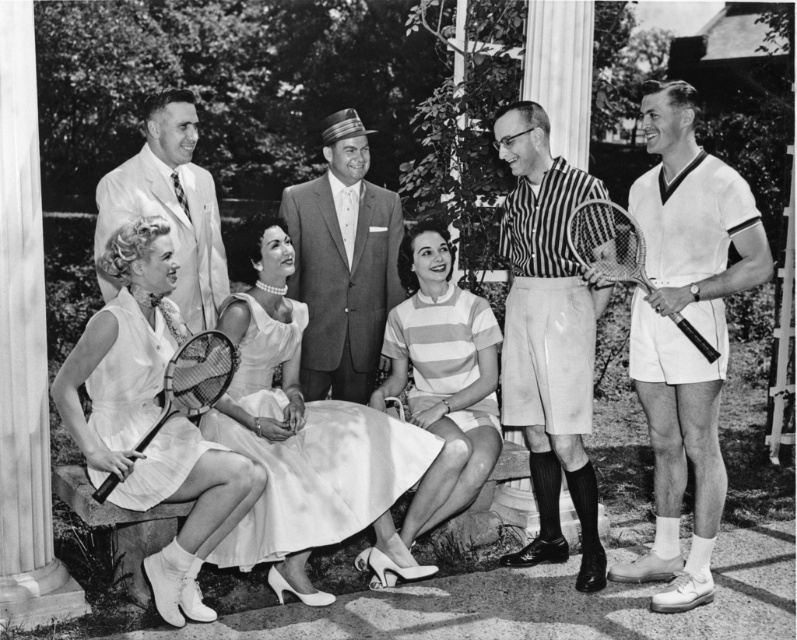
Question: Does satin white dress at center have a greater width compared to white satin dress at left?

Choices:
 (A) yes
 (B) no

Answer: (A)

Question: Where is white satin dress at left located in relation to striped fabric dress at center in the image?

Choices:
 (A) below
 (B) above

Answer: (A)

Question: Which is farther from the satin white dress at center?

Choices:
 (A) matte white racket at lower left
 (B) metallic silver tennis racket at right
 (C) striped fabric dress at center
 (D) light beige suit at left

Answer: (B)

Question: Among these objects, which one is nearest to the camera?

Choices:
 (A) white cotton shorts at right
 (B) striped fabric dress at center
 (C) light beige suit at left
 (D) striped cotton shirt at center

Answer: (A)

Question: Considering the relative positions of satin white dress at center and striped fabric dress at center in the image provided, where is satin white dress at center located with respect to striped fabric dress at center?

Choices:
 (A) right
 (B) left

Answer: (B)

Question: Among these objects, which one is farthest from the camera?

Choices:
 (A) white cotton shorts at right
 (B) light beige suit at left
 (C) matte white racket at lower left

Answer: (B)